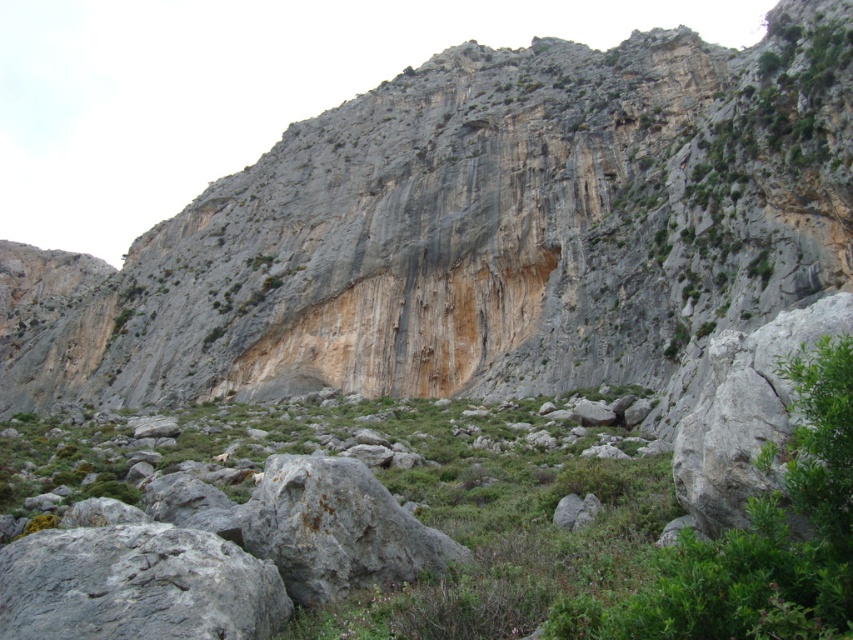
Does gray rock formation at center appear under green leafy bush at center?

No, gray rock formation at center is not below green leafy bush at center.

Is gray rock formation at center positioned before green leafy bush at center?

No, it is behind green leafy bush at center.

Identify the location of gray rock formation at center. (476, 230).

Where is `gray rock formation at center`? gray rock formation at center is located at coordinates (476, 230).

Which is below, green leafy bush at center or gray rough rock at lower left?

Positioned lower is gray rough rock at lower left.

Who is taller, green leafy bush at center or gray rough rock at lower left?

green leafy bush at center is taller.

At what (x,y) coordinates should I click in order to perform the action: click on green leafy bush at center. Please return your answer as a coordinate pair (x, y). Looking at the image, I should click on (758, 540).

Between gray rock formation at center and gray rough rock at lower left, which one is positioned lower?

gray rough rock at lower left is lower down.

Can you confirm if gray rock formation at center is wider than gray rough rock at lower left?

Yes, gray rock formation at center is wider than gray rough rock at lower left.

Who is more forward, (613, 237) or (10, 595)?

Positioned in front is point (10, 595).

Locate an element on the screen. The width and height of the screenshot is (853, 640). gray rock formation at center is located at coordinates [x=476, y=230].